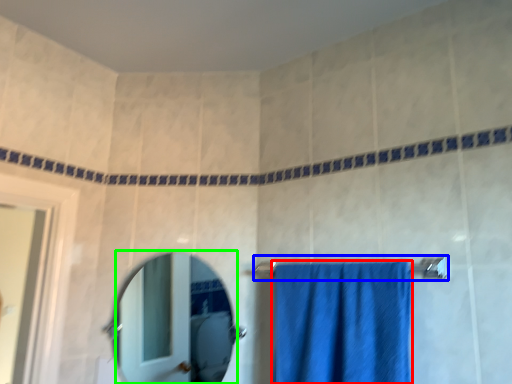
Question: Which object is positioned farthest from towel (highlighted by a red box)? Select from towel bar (highlighted by a blue box) and mirror (highlighted by a green box).

Choices:
 (A) towel bar
 (B) mirror

Answer: (B)